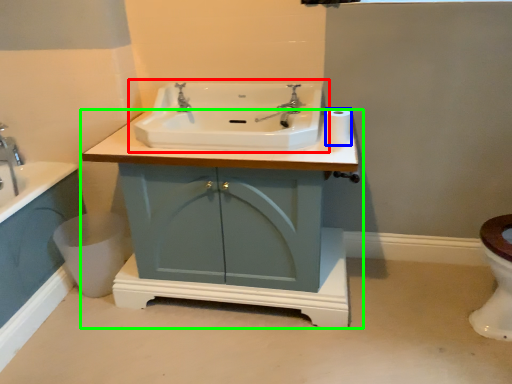
Question: Considering the real-world distances, which object is closest to sink (highlighted by a red box)? toilet paper (highlighted by a blue box) or bathroom cabinet (highlighted by a green box).

Choices:
 (A) toilet paper
 (B) bathroom cabinet

Answer: (A)